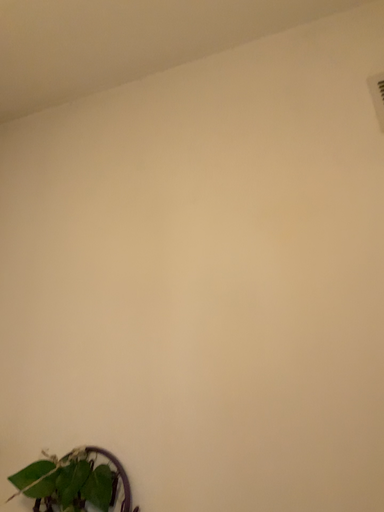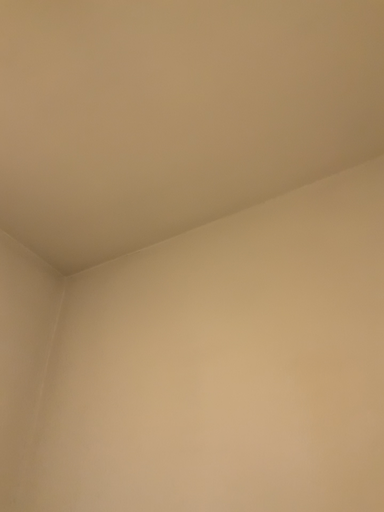
Question: Which way did the camera rotate in the video?

Choices:
 (A) rotated upward
 (B) rotated downward

Answer: (A)